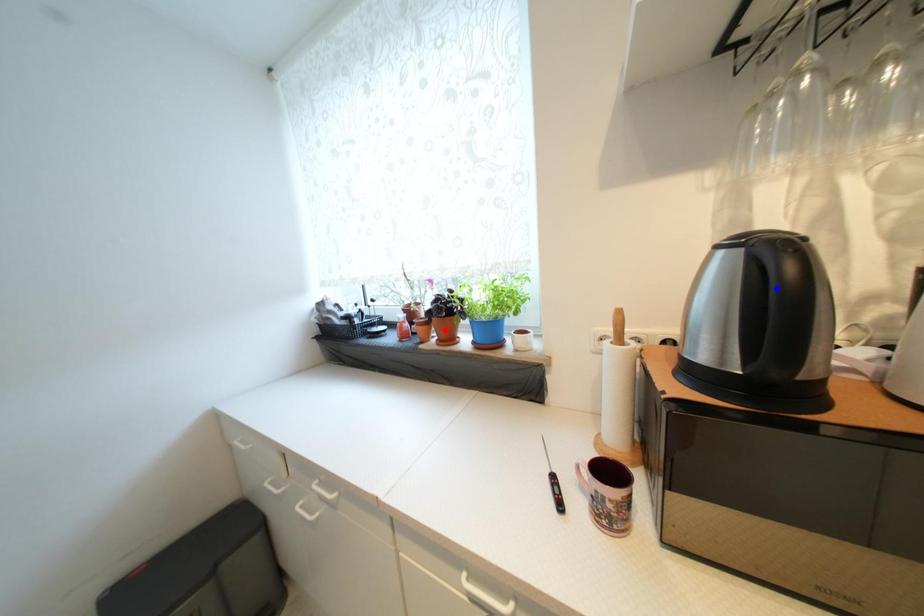
Question: In the image, two points are highlighted. Which point is nearer to the camera? Reply with the corresponding letter.

Choices:
 (A) blue point
 (B) red point

Answer: (A)